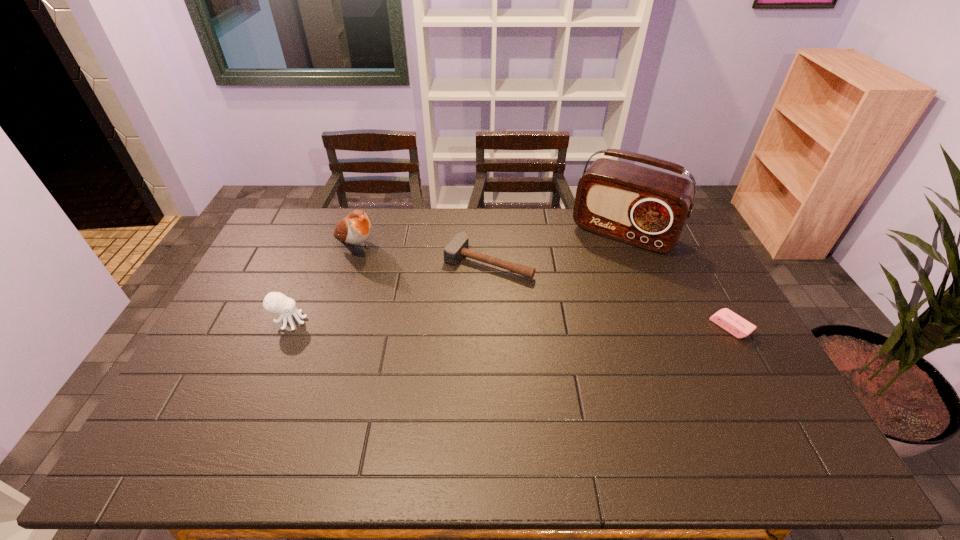
This screenshot has width=960, height=540. Find the location of `free space on the desktop that is between the third shortest object and the shortest object and is positioned on the front panel of the radio receiver`. free space on the desktop that is between the third shortest object and the shortest object and is positioned on the front panel of the radio receiver is located at coordinates (572, 325).

Where is `free space on the desktop that is between the third shortest object and the eraser and is positioned at the face of the bird`? free space on the desktop that is between the third shortest object and the eraser and is positioned at the face of the bird is located at coordinates (454, 323).

Locate an element on the screen. vacant space on the desktop that is between the third shortest object and the eraser and is positioned on the striking surface of the second shortest object is located at coordinates (444, 323).